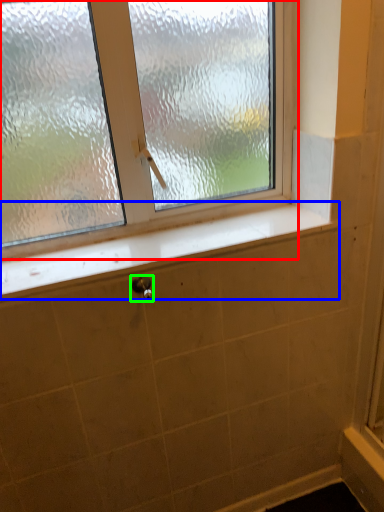
Question: Based on their relative distances, which object is nearer to window (highlighted by a red box)? Choose from window sill (highlighted by a blue box) and shower (highlighted by a green box).

Choices:
 (A) window sill
 (B) shower

Answer: (A)